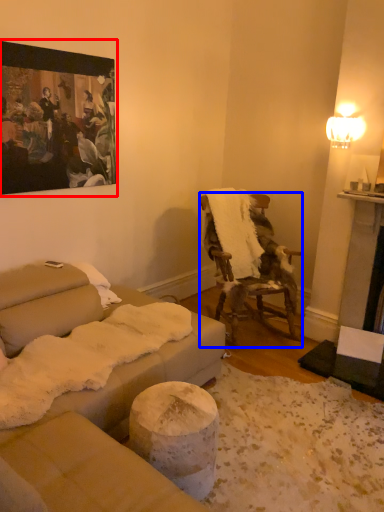
Question: Among these objects, which one is farthest to the camera, picture frame (highlighted by a red box) or chair (highlighted by a blue box)?

Choices:
 (A) picture frame
 (B) chair

Answer: (B)